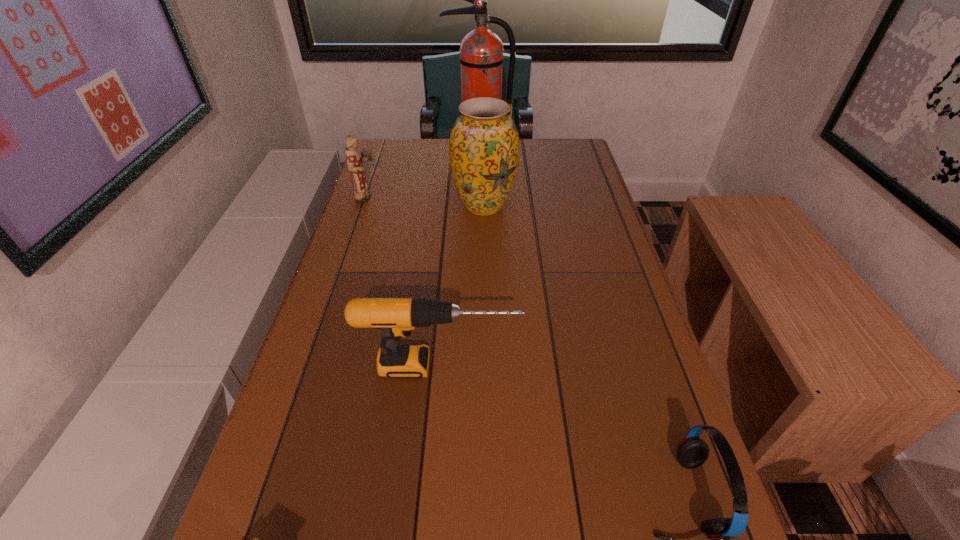
Locate an element on the screen. the fifth closest object to the second nearest object is located at coordinates (481, 58).

Choose which object is the third nearest neighbor to the figurine. Please provide its 2D coordinates. Your answer should be formatted as a tuple, i.e. [(x, y)], where the tuple contains the x and y coordinates of a point satisfying the conditions above.

[(396, 317)]

Identify the location of vacant position in the image that satisfies the following two spatial constraints: 1. at the nozzle of the farthest object; 2. on the handle side of the drill. The image size is (960, 540). (478, 366).

The height and width of the screenshot is (540, 960). Identify the location of free space that satisfies the following two spatial constraints: 1. at the nozzle of the fifth shortest object; 2. on the right side of the fire extinguisher. (479, 206).